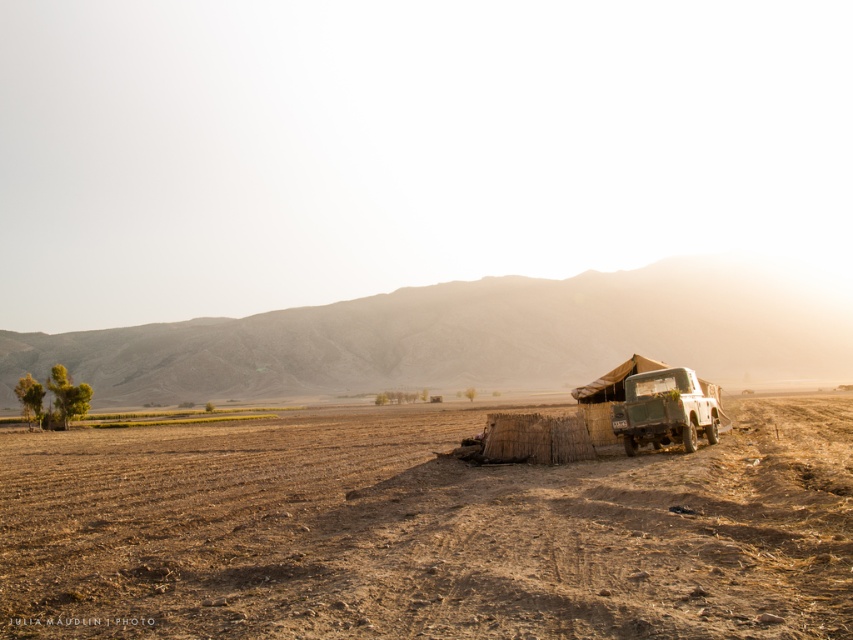
Question: Considering the relative positions of brown dirt field at center and matte green jeep at right in the image provided, where is brown dirt field at center located with respect to matte green jeep at right?

Choices:
 (A) above
 (B) below

Answer: (B)

Question: Among these points, which one is farthest from the camera?

Choices:
 (A) (77, 515)
 (B) (656, 380)

Answer: (B)

Question: Which object appears farthest from the camera in this image?

Choices:
 (A) brown dirt field at center
 (B) matte green jeep at right

Answer: (B)

Question: From the image, what is the correct spatial relationship of brown dirt field at center in relation to matte green jeep at right?

Choices:
 (A) below
 (B) above

Answer: (A)

Question: Does brown dirt field at center appear on the right side of matte green jeep at right?

Choices:
 (A) yes
 (B) no

Answer: (B)